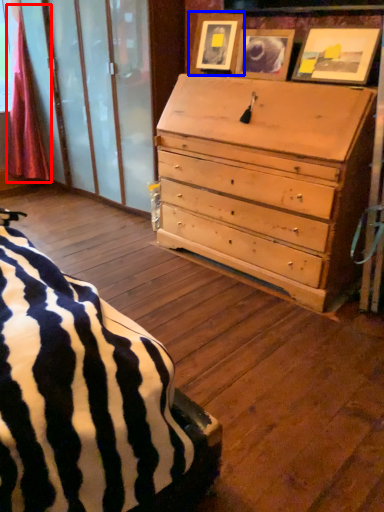
Question: Which of the following is the farthest to the observer, curtain (highlighted by a red box) or picture frame (highlighted by a blue box)?

Choices:
 (A) curtain
 (B) picture frame

Answer: (A)